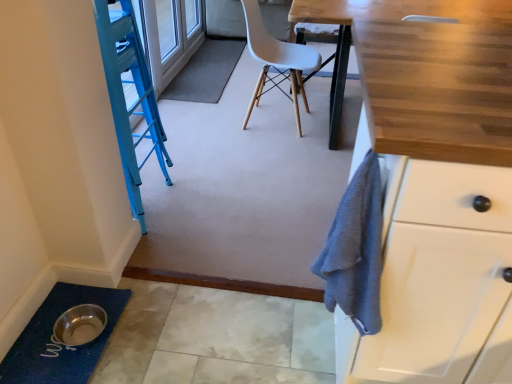
Question: Considering the positions of point (201, 82) and point (70, 382), is point (201, 82) closer or farther from the camera than point (70, 382)?

Choices:
 (A) farther
 (B) closer

Answer: (A)

Question: In terms of width, does gray carpet at center, the 2th bath mat positioned from the front, look wider or thinner when compared to blue textured bath mat at lower left, the 2th bath mat viewed from the back?

Choices:
 (A) thin
 (B) wide

Answer: (B)

Question: Which is farther from the gray carpet at center, the 2th bath mat positioned from the front?

Choices:
 (A) white plastic chair at center
 (B) blue textured bath mat at lower left, the 1th bath mat ordered from the bottom

Answer: (B)

Question: Which of these objects is positioned closest to the white plastic chair at center?

Choices:
 (A) gray carpet at center, the 2th bath mat positioned from the front
 (B) blue textured bath mat at lower left, the 2th bath mat viewed from the back

Answer: (A)